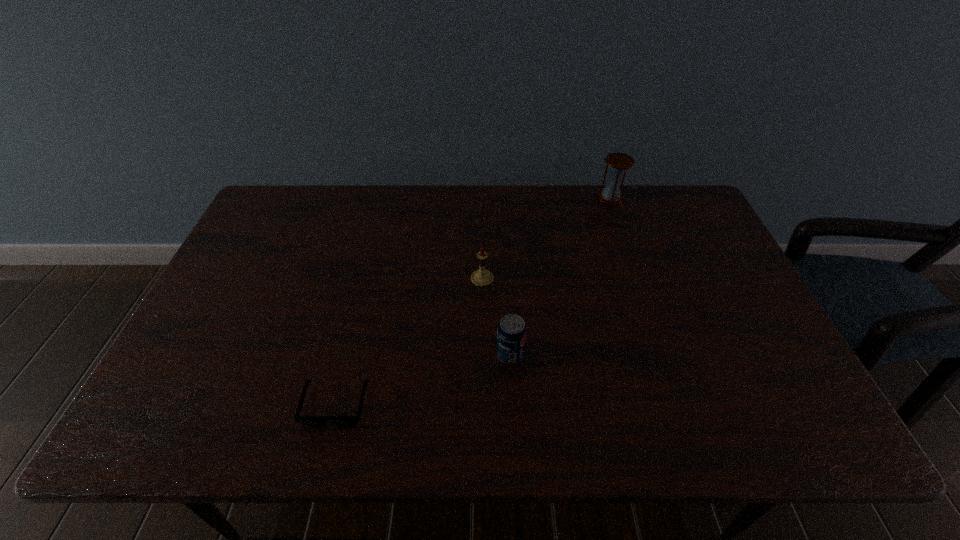
You are a GUI agent. You are given a task and a screenshot of the screen. Output one action in this format:
    pyautogui.click(x=<x>, y=<y>)
    Task: Click on the vacant area that lies between the hourglass and the third object from left to right
    This screenshot has width=960, height=540.
    Given the screenshot: What is the action you would take?
    pyautogui.click(x=561, y=276)

At what (x,y) coordinates should I click in order to perform the action: click on vacant space in between the sunglasses and the tallest object. Please return your answer as a coordinate pair (x, y). The height and width of the screenshot is (540, 960). Looking at the image, I should click on (473, 301).

Identify the location of free space between the candle and the second object from right to left. The width and height of the screenshot is (960, 540). (496, 316).

This screenshot has width=960, height=540. I want to click on free area in between the tallest object and the leftmost object, so click(473, 301).

Locate an element on the screen. The image size is (960, 540). blank region between the nearest object and the third nearest object is located at coordinates (409, 341).

This screenshot has width=960, height=540. Identify the location of vacant point located between the pop and the nearest object. (422, 379).

At what (x,y) coordinates should I click in order to perform the action: click on vacant area between the shortest object and the candle. Please return your answer as a coordinate pair (x, y). The height and width of the screenshot is (540, 960). Looking at the image, I should click on (409, 341).

At what (x,y) coordinates should I click in order to perform the action: click on vacant space that is in between the third nearest object and the nearest object. Please return your answer as a coordinate pair (x, y). This screenshot has width=960, height=540. Looking at the image, I should click on (409, 341).

The width and height of the screenshot is (960, 540). In order to click on free area in between the pop and the sunglasses in this screenshot , I will do `click(422, 379)`.

Choose which object is the second nearest neighbor to the second nearest object. Please provide its 2D coordinates. Your answer should be formatted as a tuple, i.e. [(x, y)], where the tuple contains the x and y coordinates of a point satisfying the conditions above.

[(306, 420)]